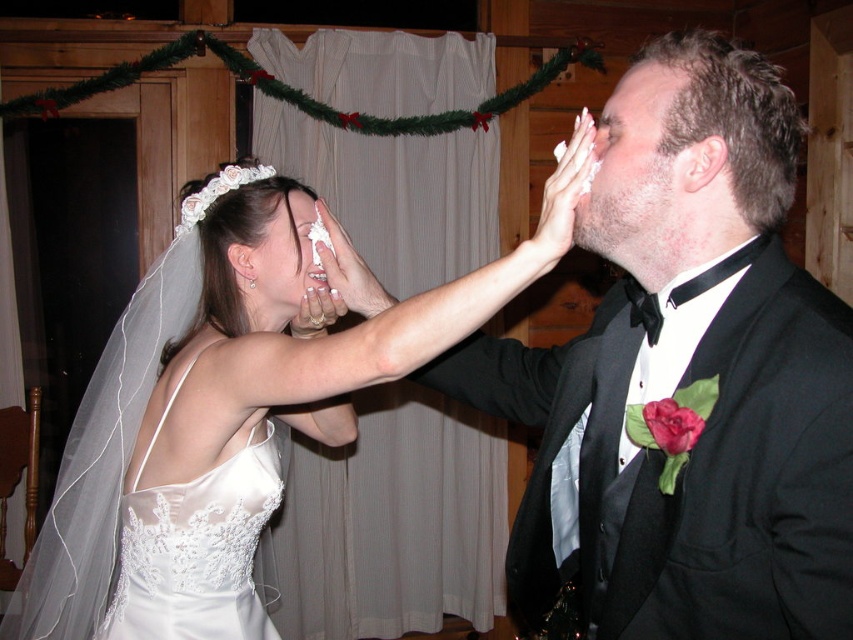
Question: Does white satin dress at center appear over matte black forehead at upper right?

Choices:
 (A) yes
 (B) no

Answer: (B)

Question: Which point is closer to the camera taking this photo?

Choices:
 (A) (131, 310)
 (B) (228, 484)
 (C) (610, 113)
 (D) (631, 115)

Answer: (D)

Question: Among these points, which one is nearest to the camera?

Choices:
 (A) (200, 298)
 (B) (213, 490)
 (C) (653, 125)
 (D) (608, 97)

Answer: (C)

Question: Is white satin dress at center below matte white cake at upper center?

Choices:
 (A) no
 (B) yes

Answer: (B)

Question: Which of the following is the closest to the observer?

Choices:
 (A) (608, 112)
 (B) (257, 611)

Answer: (A)

Question: Can you confirm if white satin dress at center is positioned below white lace dress at upper left?

Choices:
 (A) yes
 (B) no

Answer: (B)